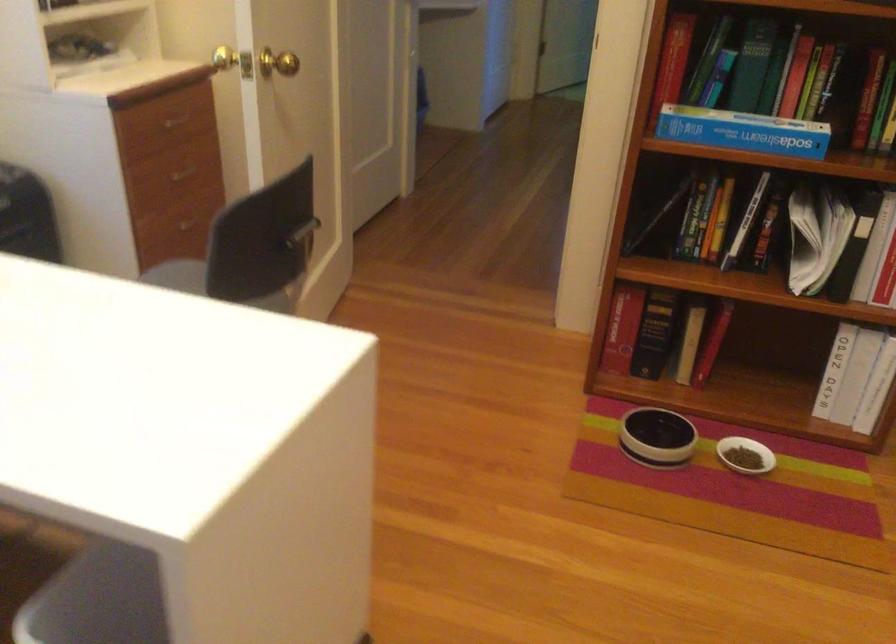
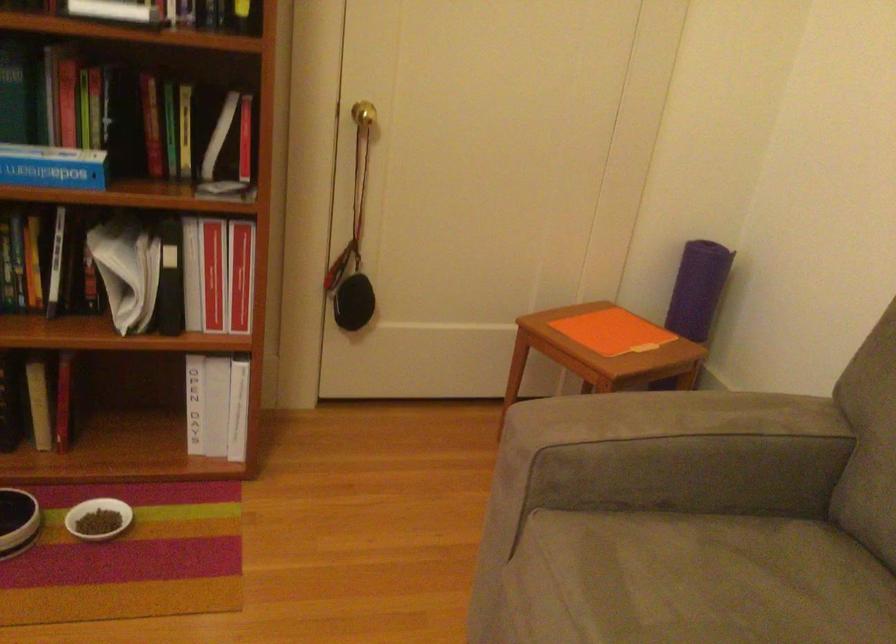
In the second image, find the point that corresponds to (784,134) in the first image.

(53, 167)